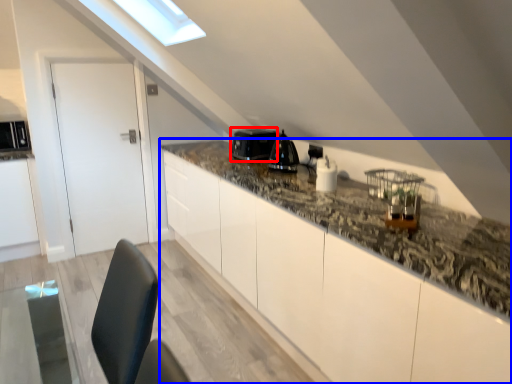
Question: Which point is closer to the camera, appliance (highlighted by a red box) or countertop (highlighted by a blue box)?

Choices:
 (A) appliance
 (B) countertop

Answer: (B)